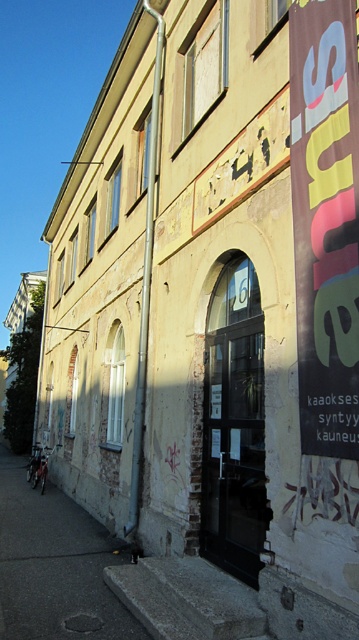
You are standing in front of the weathered building and notice two points marked on its facade. The first point is at coordinates point (337, 179) and the second at point (115, 541). Which of these points is nearer to your current position?

Point (337, 179) is closer to the viewer than point (115, 541).